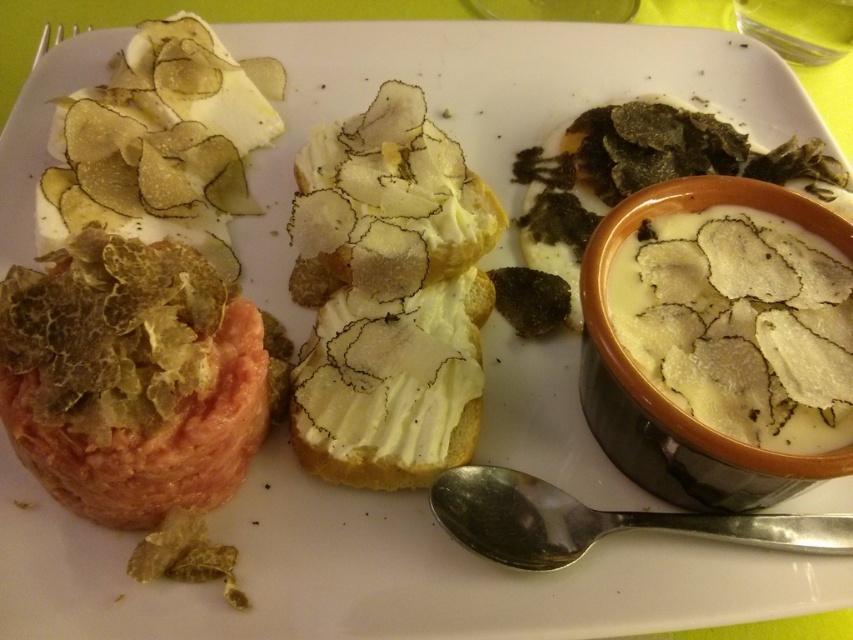
Between point (718, 436) and point (689, 518), which one is positioned in front?

Point (718, 436) is more forward.

Locate an element on the screen. white ceramic bowl at upper right is located at coordinates coord(662,396).

Does white ceramic bowl at upper right appear on the left side of black matte truffle at upper right?

Indeed, white ceramic bowl at upper right is positioned on the left side of black matte truffle at upper right.

Can you confirm if white ceramic bowl at upper right is smaller than black matte truffle at upper right?

Incorrect, white ceramic bowl at upper right is not smaller in size than black matte truffle at upper right.

Between point (630, 408) and point (581, 234), which one is positioned in front?

Positioned in front is point (630, 408).

This screenshot has width=853, height=640. Identify the location of white ceramic bowl at upper right. 662,396.

Does black matte truffle at upper right have a larger size compared to silver metallic spoon at lower center?

Yes, black matte truffle at upper right is bigger than silver metallic spoon at lower center.

Can you confirm if black matte truffle at upper right is smaller than silver metallic spoon at lower center?

No.

Find the location of a particular element. Image resolution: width=853 pixels, height=640 pixels. black matte truffle at upper right is located at coordinates (646, 173).